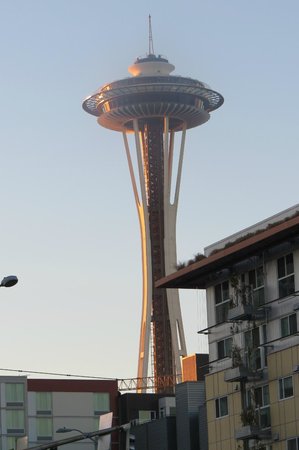
The image size is (299, 450). Find the location of `yellow wall`. yellow wall is located at coordinates (219, 429).